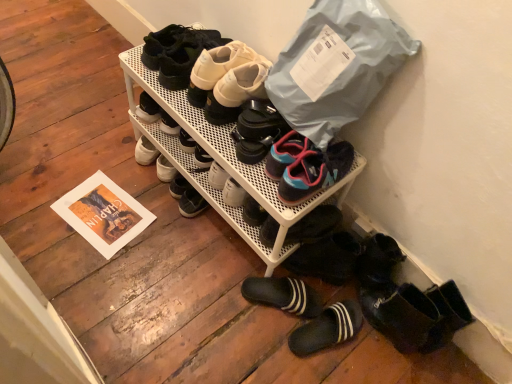
Where is `vacant point to the left of black rubber slippers at lower center, the 1th footwear in the bottom-to-top sequence`? The height and width of the screenshot is (384, 512). vacant point to the left of black rubber slippers at lower center, the 1th footwear in the bottom-to-top sequence is located at coordinates (254, 329).